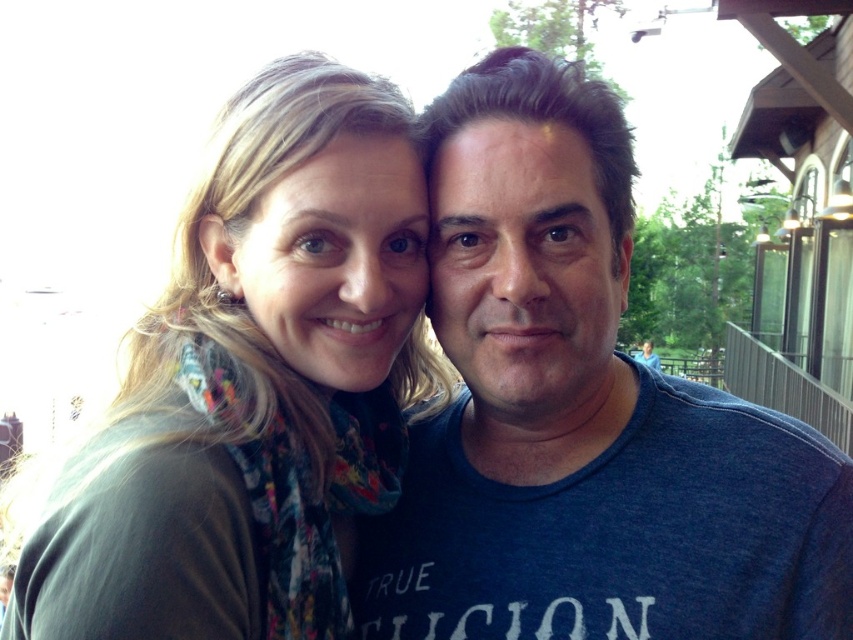
Question: Does blue cotton shirt at center have a larger size compared to multicolored scarf at center?

Choices:
 (A) yes
 (B) no

Answer: (B)

Question: Is blue cotton shirt at center positioned in front of multicolored scarf at center?

Choices:
 (A) no
 (B) yes

Answer: (A)

Question: In this image, where is blue cotton shirt at center located relative to multicolored scarf at center?

Choices:
 (A) below
 (B) above

Answer: (B)

Question: Which point is farther to the camera?

Choices:
 (A) blue cotton shirt at center
 (B) multicolored scarf at center

Answer: (A)

Question: Which point is closer to the camera taking this photo?

Choices:
 (A) (641, 625)
 (B) (283, 212)

Answer: (A)